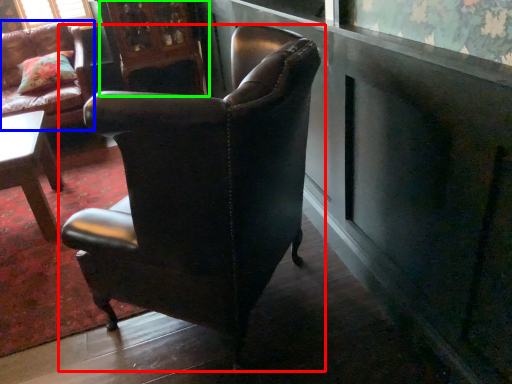
Question: Which object is positioned farthest from chair (highlighted by a red box)? Select from chair (highlighted by a blue box) and armoire (highlighted by a green box).

Choices:
 (A) chair
 (B) armoire

Answer: (B)